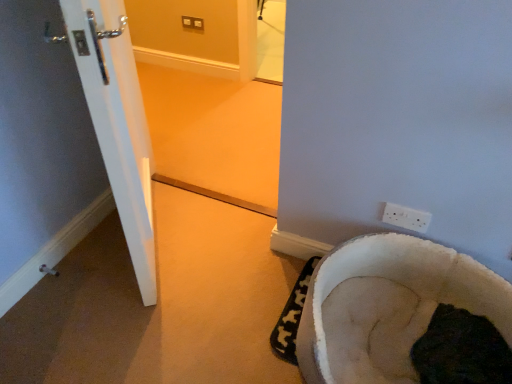
Question: Looking at their shapes, would you say dark fur bed at lower right is wider or thinner than white fluffy pet bed at lower right?

Choices:
 (A) thin
 (B) wide

Answer: (A)

Question: In the image, is dark fur bed at lower right on the left side or the right side of white fluffy pet bed at lower right?

Choices:
 (A) left
 (B) right

Answer: (B)

Question: Estimate the real-world distances between objects in this image. Which object is farther from the white fluffy pet bed at lower right?

Choices:
 (A) white plastic electric outlet at lower right
 (B) white glossy door at lower left
 (C) dark fur bed at lower right

Answer: (B)

Question: Which of these objects is positioned closest to the white plastic electric outlet at lower right?

Choices:
 (A) white glossy door at lower left
 (B) dark fur bed at lower right
 (C) white fluffy pet bed at lower right

Answer: (C)